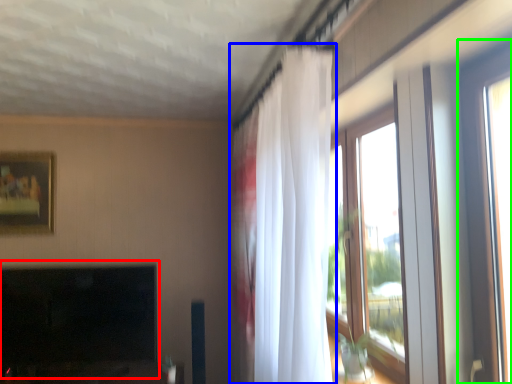
Question: Which is nearer to the fireplace (highlighted by a red box)? curtain (highlighted by a blue box) or window (highlighted by a green box).

Choices:
 (A) curtain
 (B) window

Answer: (A)